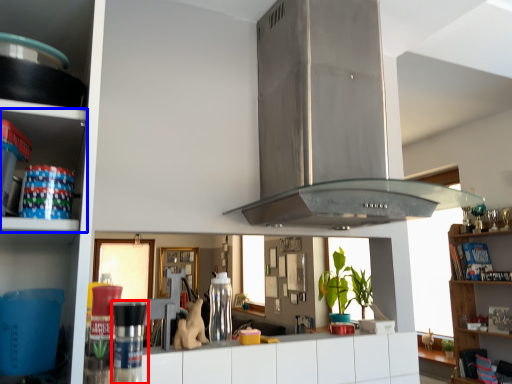
Question: Which of the following is the closest to the observer, appliance (highlighted by a red box) or shelf (highlighted by a blue box)?

Choices:
 (A) appliance
 (B) shelf

Answer: (B)